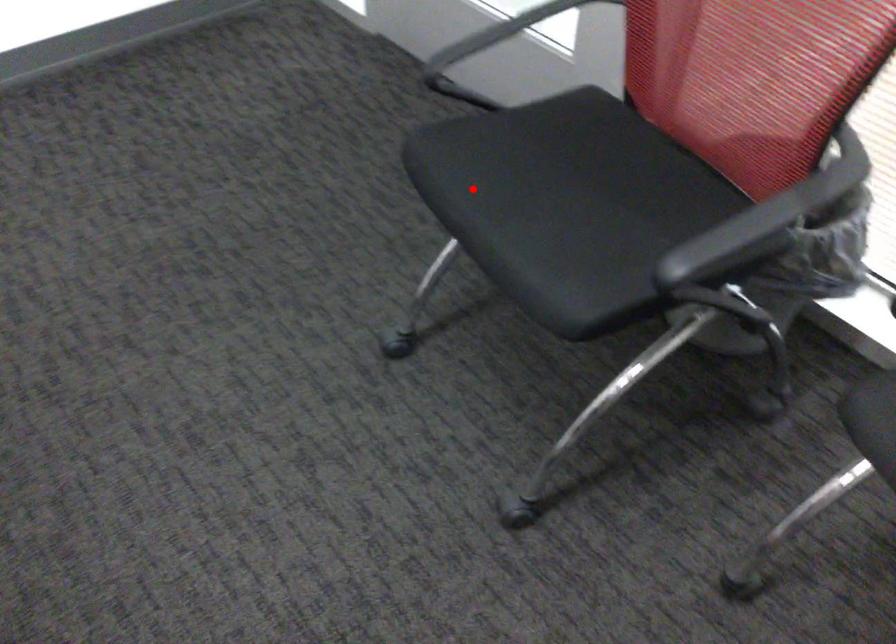
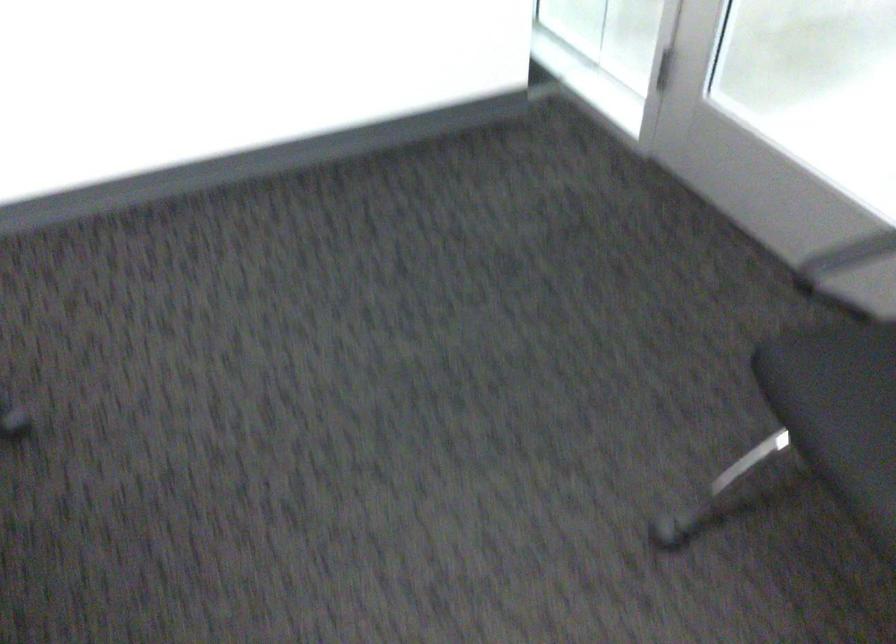
Find the pixel in the second image that matches the highlighted location in the first image.

(839, 410)